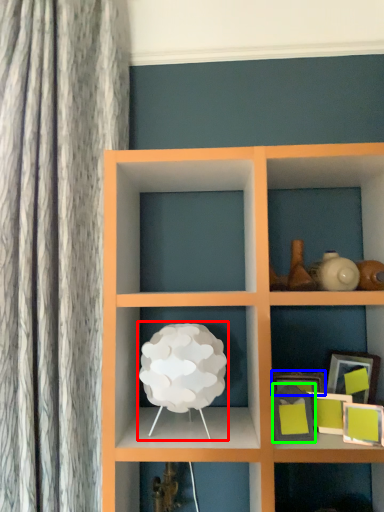
Question: Considering the real-world distances, which object is closest to table lamp (highlighted by a red box)? picture frame (highlighted by a blue box) or picture frame (highlighted by a green box).

Choices:
 (A) picture frame
 (B) picture frame

Answer: (B)